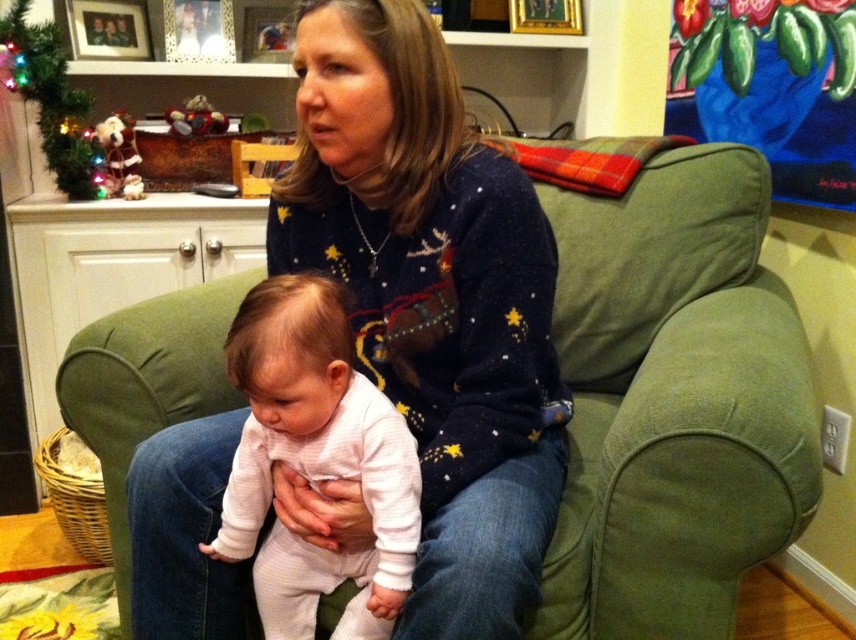
What are the coordinates of the navy sweater at center?

The navy sweater at center is located at coordinates point (432, 300).

Looking at this image, you are a photographer setting up for a family photo. You need to ensure that the white soft onesie at center and the green artificial christmas tree at upper left are both visible in the frame. Based on their sizes, which object might require adjusting the camera angle to include it in the shot?

The white soft onesie at center might be wider than the green artificial christmas tree at upper left, so the onesie could require adjusting the camera angle to ensure it fits within the frame.